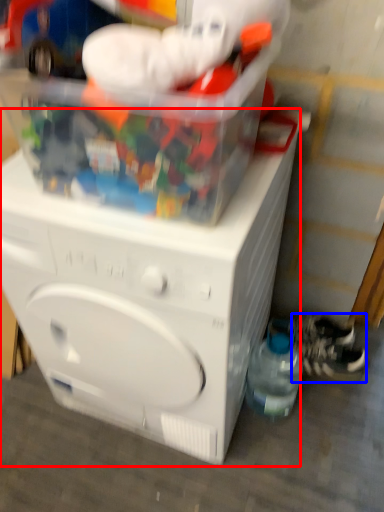
Question: Which of the following is the farthest to the observer, washing machine (highlighted by a red box) or shoe (highlighted by a blue box)?

Choices:
 (A) washing machine
 (B) shoe

Answer: (B)